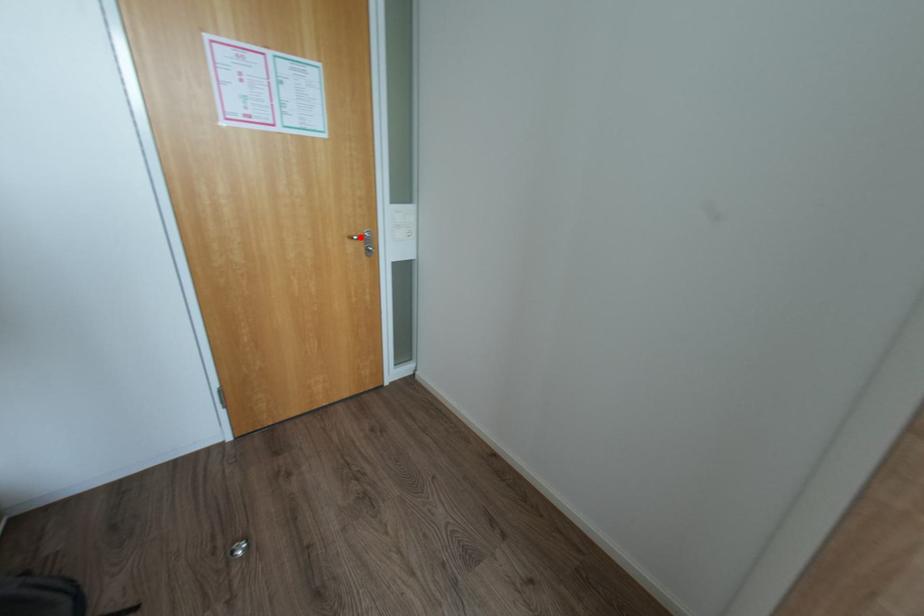
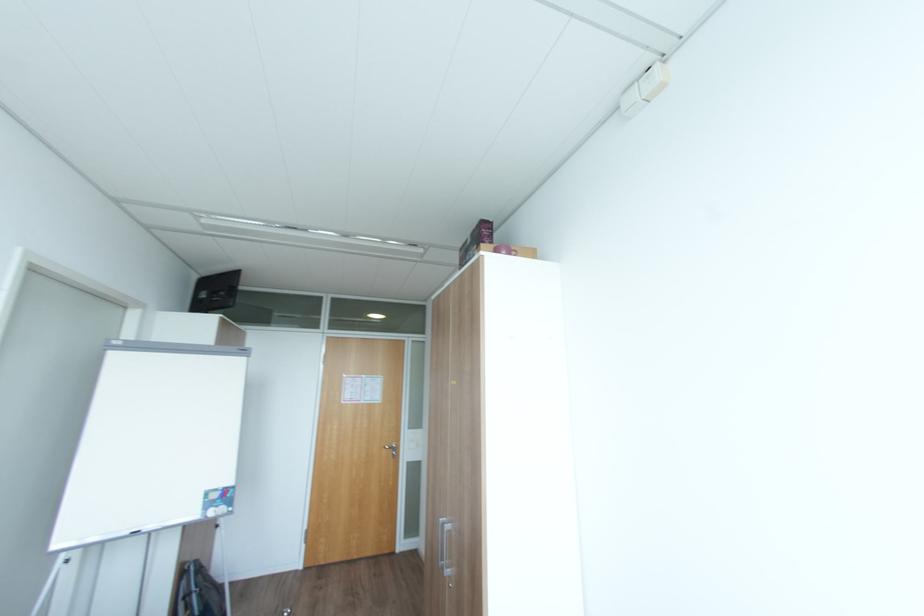
Question: A red point is marked in image1. In image2, is the corresponding 3D point closer to the camera or farther? Reply with the corresponding letter.

Choices:
 (A) The corresponding 3D point is closer.
 (B) The corresponding 3D point is farther.

Answer: (B)